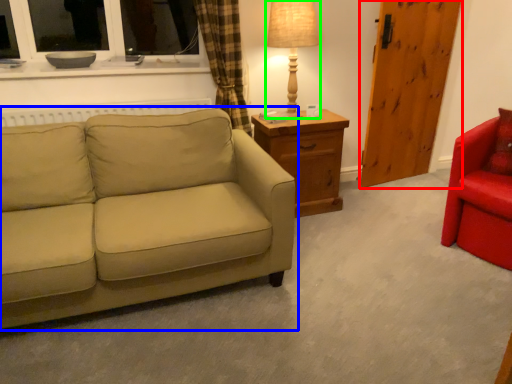
Question: Estimate the real-world distances between objects in this image. Which object is closer to barn door (highlighted by a red box), studio couch (highlighted by a blue box) or table lamp (highlighted by a green box)?

Choices:
 (A) studio couch
 (B) table lamp

Answer: (B)